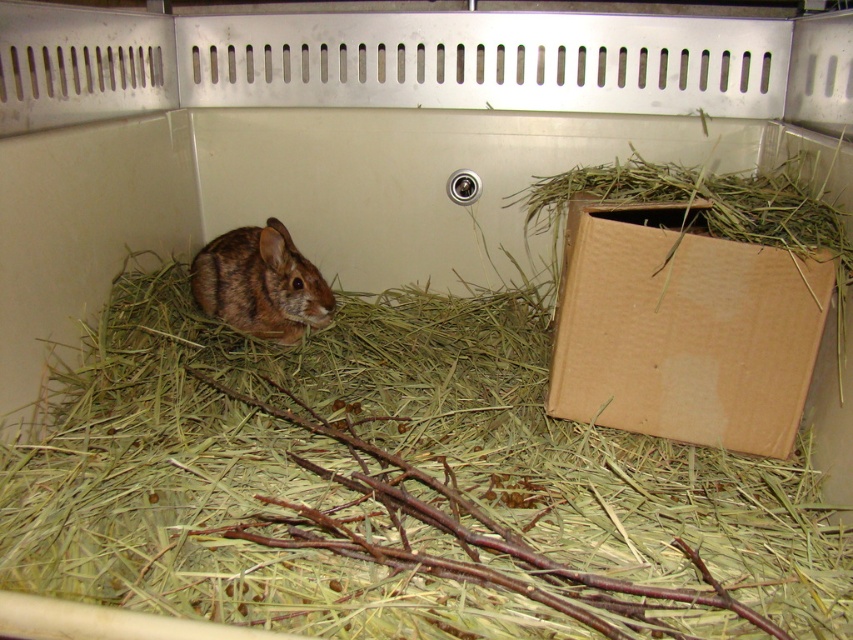
Question: Can you confirm if green straw at center is smaller than brown furry rabbit at center?

Choices:
 (A) yes
 (B) no

Answer: (B)

Question: Which object is closer to the camera taking this photo?

Choices:
 (A) brown furry rabbit at center
 (B) brown cardboard box at right

Answer: (B)

Question: Which object is positioned farthest from the brown rough twigs at center?

Choices:
 (A) brown cardboard box at right
 (B) brown furry rabbit at center

Answer: (B)

Question: Considering the real-world distances, which object is closest to the brown rough twigs at center?

Choices:
 (A) green straw at center
 (B) brown furry rabbit at center
 (C) brown cardboard box at right

Answer: (A)

Question: Considering the relative positions of green straw at center and brown cardboard box at right in the image provided, where is green straw at center located with respect to brown cardboard box at right?

Choices:
 (A) left
 (B) right

Answer: (A)

Question: Can you confirm if green straw at center is positioned to the right of brown rough twigs at center?

Choices:
 (A) yes
 (B) no

Answer: (A)